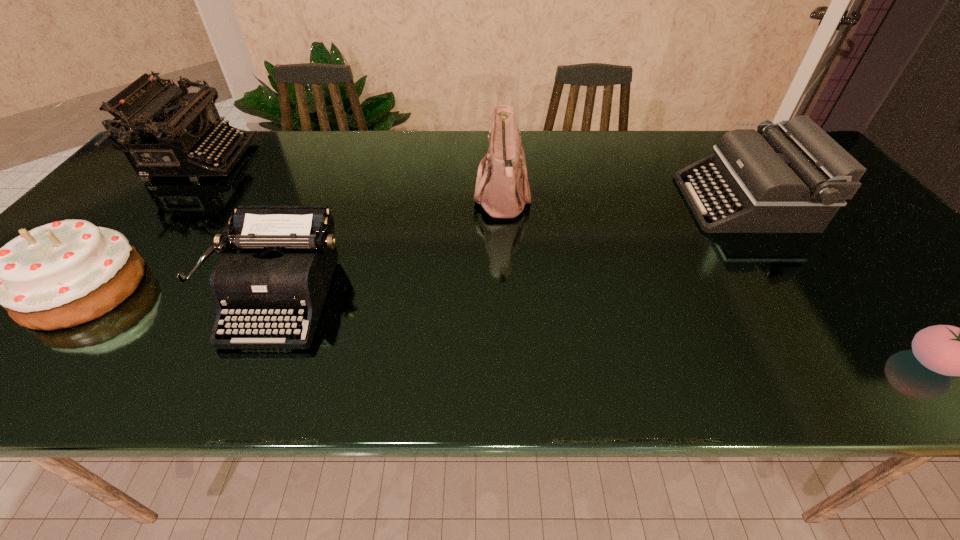
Find the location of a particular element. This screenshot has width=960, height=540. the leftmost typewriter is located at coordinates (164, 131).

You are a GUI agent. You are given a task and a screenshot of the screen. Output one action in this format:
    pyautogui.click(x=<x>, y=<y>)
    Task: Click on the fourth object from left to right
    
    Given the screenshot: What is the action you would take?
    pyautogui.click(x=503, y=190)

Locate an element on the screen. the rightmost typewriter is located at coordinates (793, 178).

Locate an element on the screen. the nearest typewriter is located at coordinates (288, 254).

Locate an element on the screen. The width and height of the screenshot is (960, 540). the second typewriter from left to right is located at coordinates (288, 254).

Where is `free space located on the keyboard of the tallest typewriter`? This screenshot has height=540, width=960. free space located on the keyboard of the tallest typewriter is located at coordinates (348, 160).

What are the coordinates of `free space located 0.250m on the front pocket of the third object from right to left` in the screenshot? It's located at (380, 198).

Find the location of a particular element. The width and height of the screenshot is (960, 540). vacant space located 0.140m on the front pocket of the third object from right to left is located at coordinates (421, 198).

Identify the location of vacant space located 0.070m on the front pocket of the third object from right to left. The image size is (960, 540). (447, 198).

Where is `free space located on the typing side of the rightmost typewriter`? This screenshot has width=960, height=540. free space located on the typing side of the rightmost typewriter is located at coordinates (555, 202).